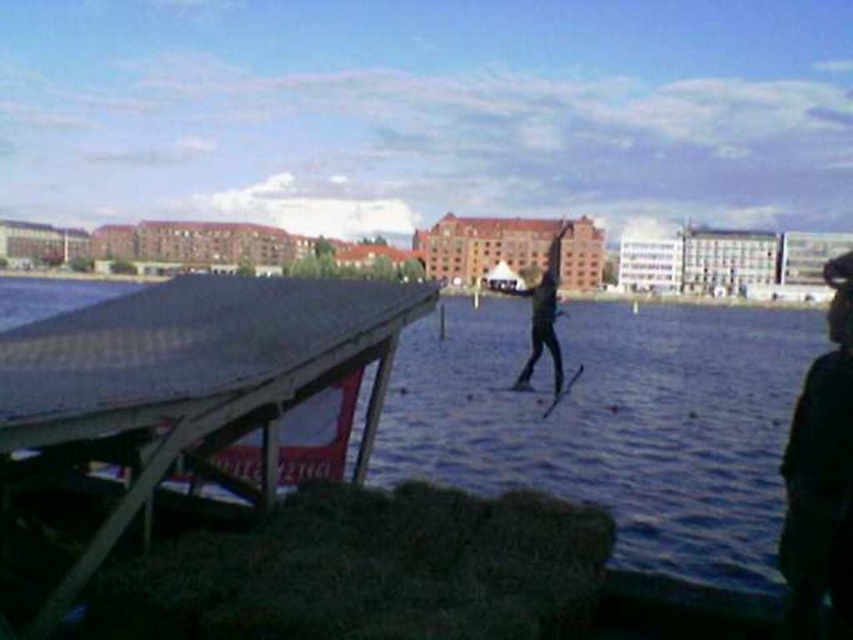
Question: Can you confirm if wooden dock at center is wider than black matte skis at center?

Choices:
 (A) yes
 (B) no

Answer: (B)

Question: Is the position of wooden dock at center less distant than that of black matte skis at center?

Choices:
 (A) no
 (B) yes

Answer: (B)

Question: Among these points, which one is farthest from the camera?

Choices:
 (A) (566, 380)
 (B) (170, 301)
 (C) (532, 292)

Answer: (C)

Question: Is wooden dock at center to the right of shiny black ski at center from the viewer's perspective?

Choices:
 (A) yes
 (B) no

Answer: (B)

Question: Estimate the real-world distances between objects in this image. Which object is farther from the wooden dock at center?

Choices:
 (A) black matte skis at center
 (B) shiny black ski at center

Answer: (A)

Question: Which of the following is the closest to the observer?

Choices:
 (A) black matte skis at center
 (B) shiny black ski at center
 (C) wooden dock at center

Answer: (C)